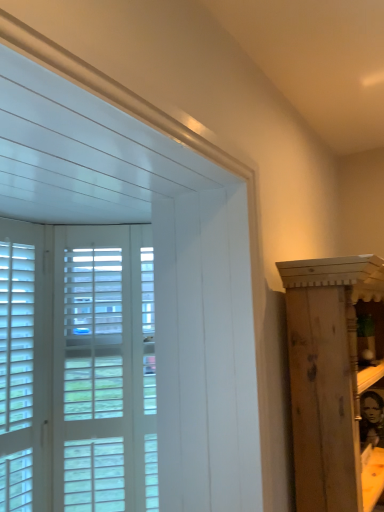
Question: Would you say wooden cabinet at right is inside or outside white wood window at left?

Choices:
 (A) outside
 (B) inside

Answer: (A)

Question: In terms of width, does wooden cabinet at right look wider or thinner when compared to white wood window at left?

Choices:
 (A) thin
 (B) wide

Answer: (B)

Question: Considering the real-world distances, which object is farthest from the white wood screen door at left?

Choices:
 (A) wooden cabinet at right
 (B) white wood window at left

Answer: (A)

Question: Considering the real-world distances, which object is closest to the white wood window at left?

Choices:
 (A) wooden cabinet at right
 (B) white wood screen door at left

Answer: (B)